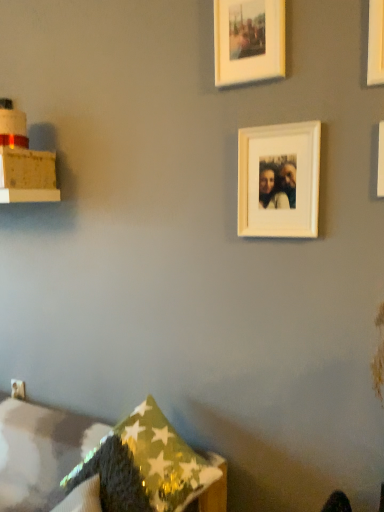
What is the approximate height of white matte picture frame at upper right, which appears as the 2th picture frame when viewed from the top?

The height of white matte picture frame at upper right, which appears as the 2th picture frame when viewed from the top, is 8.72 inches.

Locate an element on the screen. This screenshot has width=384, height=512. white matte picture frame at upper center, which ranks as the 2th picture frame in left-to-right order is located at coordinates (279, 180).

Which object is positioned more to the left, white matte picture frame at upper center, which is the 3th picture frame from bottom to top, or white matte picture frame at upper right, which appears as the 2th picture frame when viewed from the top?

white matte picture frame at upper center, which is the 3th picture frame from bottom to top, is more to the left.

Which is behind, white matte picture frame at upper center, the 1th picture frame in the top-to-bottom sequence, or white matte picture frame at upper right, the 3th picture frame positioned from the left?

white matte picture frame at upper center, the 1th picture frame in the top-to-bottom sequence, is further away from the camera.

Can you confirm if white matte picture frame at upper center, which is the first picture frame in left-to-right order, is wider than white matte picture frame at upper right, positioned as the second picture frame in bottom-to-top order?

Correct, the width of white matte picture frame at upper center, which is the first picture frame in left-to-right order, exceeds that of white matte picture frame at upper right, positioned as the second picture frame in bottom-to-top order.

Consider the image. How different are the orientations of white matte picture frame at upper center, the 1th picture frame in the top-to-bottom sequence, and white matte picture frame at upper right, the first picture frame from the right, in degrees?

The angular difference between white matte picture frame at upper center, the 1th picture frame in the top-to-bottom sequence, and white matte picture frame at upper right, the first picture frame from the right, is 1.75 degrees.

Does point (304, 205) come behind point (181, 477)?

That is True.

Is white matte picture frame at upper center, the third picture frame from the top, smaller than shiny metallic pillow at lower center, the first pillow when ordered from back to front?

Indeed, white matte picture frame at upper center, the third picture frame from the top, has a smaller size compared to shiny metallic pillow at lower center, the first pillow when ordered from back to front.

Is white matte picture frame at upper center, the 1th picture frame when ordered from bottom to top, positioned far away from shiny metallic pillow at lower center, the first pillow when ordered from back to front?

No, white matte picture frame at upper center, the 1th picture frame when ordered from bottom to top, is not far away from shiny metallic pillow at lower center, the first pillow when ordered from back to front.

Between white matte picture frame at upper center, which is the 3th picture frame from bottom to top, and white matte picture frame at upper center, the third picture frame from the top, which one has more height?

white matte picture frame at upper center, the third picture frame from the top, is taller.

Which object is closer to the camera taking this photo, white matte picture frame at upper center, the 3th picture frame in the right-to-left sequence, or white matte picture frame at upper center, which ranks as the 2th picture frame in left-to-right order?

Positioned in front is white matte picture frame at upper center, which ranks as the 2th picture frame in left-to-right order.

Considering the sizes of white matte picture frame at upper right, the first picture frame from the right, and green textured pillow at lower left, the 1th pillow viewed from the front, in the image, is white matte picture frame at upper right, the first picture frame from the right, taller or shorter than green textured pillow at lower left, the 1th pillow viewed from the front,?

Clearly, white matte picture frame at upper right, the first picture frame from the right, is shorter compared to green textured pillow at lower left, the 1th pillow viewed from the front.

How many degrees apart are the facing directions of white matte picture frame at upper right, the first picture frame from the right, and green textured pillow at lower left, arranged as the second pillow when viewed from the back?

The angular difference between white matte picture frame at upper right, the first picture frame from the right, and green textured pillow at lower left, arranged as the second pillow when viewed from the back, is 28.4 degrees.

Could you tell me if white matte picture frame at upper right, the 3th picture frame positioned from the left, is turned towards green textured pillow at lower left, arranged as the second pillow when viewed from the back?

No, white matte picture frame at upper right, the 3th picture frame positioned from the left, is not oriented towards green textured pillow at lower left, arranged as the second pillow when viewed from the back.

Considering the positions of objects white matte picture frame at upper right, positioned as the second picture frame in bottom-to-top order, and green textured pillow at lower left, arranged as the second pillow when viewed from the back, in the image provided, who is more to the left, white matte picture frame at upper right, positioned as the second picture frame in bottom-to-top order, or green textured pillow at lower left, arranged as the second pillow when viewed from the back,?

green textured pillow at lower left, arranged as the second pillow when viewed from the back.

Considering the relative positions of shiny metallic pillow at lower center, the first pillow when ordered from back to front, and white matte picture frame at upper right, positioned as the second picture frame in bottom-to-top order, in the image provided, is shiny metallic pillow at lower center, the first pillow when ordered from back to front, in front of white matte picture frame at upper right, positioned as the second picture frame in bottom-to-top order,?

Yes, it is in front of white matte picture frame at upper right, positioned as the second picture frame in bottom-to-top order.

Is point (146, 420) more distant than point (379, 181)?

Yes, it is.

Is shiny metallic pillow at lower center, the first pillow when ordered from back to front, bigger than white matte picture frame at upper right, the 3th picture frame positioned from the left?

Yes, shiny metallic pillow at lower center, the first pillow when ordered from back to front, is bigger than white matte picture frame at upper right, the 3th picture frame positioned from the left.

Is shiny metallic pillow at lower center, marked as the 2th pillow in a front-to-back arrangement, positioned with its back to white matte picture frame at upper right, which appears as the 2th picture frame when viewed from the top?

That's not correct — shiny metallic pillow at lower center, marked as the 2th pillow in a front-to-back arrangement, is not looking away from white matte picture frame at upper right, which appears as the 2th picture frame when viewed from the top.

Is white matte picture frame at upper center, arranged as the second picture frame when viewed from the right, oriented away from green textured pillow at lower left, arranged as the second pillow when viewed from the back?

No.

Is point (311, 187) positioned before point (117, 485)?

No.

Considering the relative sizes of white matte picture frame at upper center, which ranks as the 2th picture frame in left-to-right order, and green textured pillow at lower left, arranged as the second pillow when viewed from the back, in the image provided, is white matte picture frame at upper center, which ranks as the 2th picture frame in left-to-right order, smaller than green textured pillow at lower left, arranged as the second pillow when viewed from the back,?

Correct, white matte picture frame at upper center, which ranks as the 2th picture frame in left-to-right order, occupies less space than green textured pillow at lower left, arranged as the second pillow when viewed from the back.

From a real-world perspective, is white matte picture frame at upper center, which ranks as the 2th picture frame in left-to-right order, over green textured pillow at lower left, arranged as the second pillow when viewed from the back?

Yes, from a real-world perspective, white matte picture frame at upper center, which ranks as the 2th picture frame in left-to-right order, is over green textured pillow at lower left, arranged as the second pillow when viewed from the back

Is shiny metallic pillow at lower center, the first pillow when ordered from back to front, next to green textured pillow at lower left, arranged as the second pillow when viewed from the back, and touching it?

Indeed, shiny metallic pillow at lower center, the first pillow when ordered from back to front, and green textured pillow at lower left, arranged as the second pillow when viewed from the back, are beside each other and touching.

In the scene shown: Considering the relative positions of shiny metallic pillow at lower center, marked as the 2th pillow in a front-to-back arrangement, and green textured pillow at lower left, arranged as the second pillow when viewed from the back, in the image provided, is shiny metallic pillow at lower center, marked as the 2th pillow in a front-to-back arrangement, to the left of green textured pillow at lower left, arranged as the second pillow when viewed from the back, from the viewer's perspective?

In fact, shiny metallic pillow at lower center, marked as the 2th pillow in a front-to-back arrangement, is to the right of green textured pillow at lower left, arranged as the second pillow when viewed from the back.

Which of these two, shiny metallic pillow at lower center, marked as the 2th pillow in a front-to-back arrangement, or green textured pillow at lower left, the 1th pillow viewed from the front, is bigger?

With larger size is shiny metallic pillow at lower center, marked as the 2th pillow in a front-to-back arrangement.

Identify the location of pillow on the right of green textured pillow at lower left, the 1th pillow viewed from the front. (144, 466).

At what (x,y) coordinates should I click in order to perform the action: click on picture frame that appears above the white matte picture frame at upper right, positioned as the second picture frame in bottom-to-top order (from the image's perspective). Please return your answer as a coordinate pair (x, y). Looking at the image, I should click on (248, 40).

You are a GUI agent. You are given a task and a screenshot of the screen. Output one action in this format:
    pyautogui.click(x=<x>, y=<y>)
    Task: Click on the 2nd pillow directly beneath the white matte picture frame at upper center, the 1th picture frame when ordered from bottom to top (from a real-world perspective)
    The height and width of the screenshot is (512, 384).
    Given the screenshot: What is the action you would take?
    pyautogui.click(x=144, y=466)

Which object lies further to the anchor point green textured pillow at lower left, arranged as the second pillow when viewed from the back, white matte picture frame at upper center, which is the 3th picture frame from bottom to top, or white matte picture frame at upper right, positioned as the second picture frame in bottom-to-top order?

Among the two, white matte picture frame at upper center, which is the 3th picture frame from bottom to top, is located further to green textured pillow at lower left, arranged as the second pillow when viewed from the back.

Considering their positions, is white matte picture frame at upper right, positioned as the second picture frame in bottom-to-top order, positioned further to white matte picture frame at upper center, the 1th picture frame in the top-to-bottom sequence, than shiny metallic pillow at lower center, marked as the 2th pillow in a front-to-back arrangement?

Among the two, shiny metallic pillow at lower center, marked as the 2th pillow in a front-to-back arrangement, is located further to white matte picture frame at upper center, the 1th picture frame in the top-to-bottom sequence.

Estimate the real-world distances between objects in this image. Which object is closer to white matte picture frame at upper right, the 3th picture frame positioned from the left, white matte picture frame at upper center, arranged as the second picture frame when viewed from the right, or shiny metallic pillow at lower center, marked as the 2th pillow in a front-to-back arrangement?

Based on the image, white matte picture frame at upper center, arranged as the second picture frame when viewed from the right, appears to be nearer to white matte picture frame at upper right, the 3th picture frame positioned from the left.

From the image, which object appears to be farther from white matte picture frame at upper right, which appears as the 2th picture frame when viewed from the top, shiny metallic pillow at lower center, marked as the 2th pillow in a front-to-back arrangement, or green textured pillow at lower left, the 1th pillow viewed from the front?

green textured pillow at lower left, the 1th pillow viewed from the front.

Which object lies further to the anchor point shiny metallic pillow at lower center, marked as the 2th pillow in a front-to-back arrangement, white matte picture frame at upper center, the 1th picture frame in the top-to-bottom sequence, or green textured pillow at lower left, the 1th pillow viewed from the front?

white matte picture frame at upper center, the 1th picture frame in the top-to-bottom sequence, is positioned further to the anchor shiny metallic pillow at lower center, marked as the 2th pillow in a front-to-back arrangement.

Looking at the image, which one is located further to white matte picture frame at upper center, the 1th picture frame when ordered from bottom to top, shiny metallic pillow at lower center, marked as the 2th pillow in a front-to-back arrangement, or white matte picture frame at upper right, the first picture frame from the right?

shiny metallic pillow at lower center, marked as the 2th pillow in a front-to-back arrangement, is positioned further to the anchor white matte picture frame at upper center, the 1th picture frame when ordered from bottom to top.

Which object lies further to the anchor point white matte picture frame at upper right, which appears as the 2th picture frame when viewed from the top, shiny metallic pillow at lower center, the first pillow when ordered from back to front, or white matte picture frame at upper center, the third picture frame from the top?

Based on the image, shiny metallic pillow at lower center, the first pillow when ordered from back to front, appears to be further to white matte picture frame at upper right, which appears as the 2th picture frame when viewed from the top.

Considering their positions, is white matte picture frame at upper center, the 1th picture frame when ordered from bottom to top, positioned closer to shiny metallic pillow at lower center, marked as the 2th pillow in a front-to-back arrangement, than white matte picture frame at upper right, the first picture frame from the right?

white matte picture frame at upper center, the 1th picture frame when ordered from bottom to top, lies closer to shiny metallic pillow at lower center, marked as the 2th pillow in a front-to-back arrangement, than the other object.

Identify the location of picture frame that lies between white matte picture frame at upper center, which is the first picture frame in left-to-right order, and white matte picture frame at upper center, the third picture frame from the top, from top to bottom. (380, 161).

Identify the location of pillow between white matte picture frame at upper right, positioned as the second picture frame in bottom-to-top order, and shiny metallic pillow at lower center, marked as the 2th pillow in a front-to-back arrangement, vertically. (115, 478).

Where is `picture frame between white matte picture frame at upper right, which appears as the 2th picture frame when viewed from the top, and shiny metallic pillow at lower center, the first pillow when ordered from back to front, from top to bottom`? picture frame between white matte picture frame at upper right, which appears as the 2th picture frame when viewed from the top, and shiny metallic pillow at lower center, the first pillow when ordered from back to front, from top to bottom is located at coordinates (279, 180).

Locate an element on the screen. picture frame between white matte picture frame at upper right, positioned as the second picture frame in bottom-to-top order, and green textured pillow at lower left, arranged as the second pillow when viewed from the back, in the up-down direction is located at coordinates (279, 180).